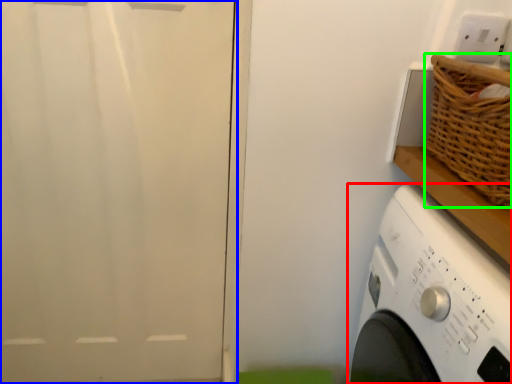
Question: Based on their relative distances, which object is nearer to washing machine (highlighted by a red box)? Choose from screen door (highlighted by a blue box) and basket (highlighted by a green box).

Choices:
 (A) screen door
 (B) basket

Answer: (B)